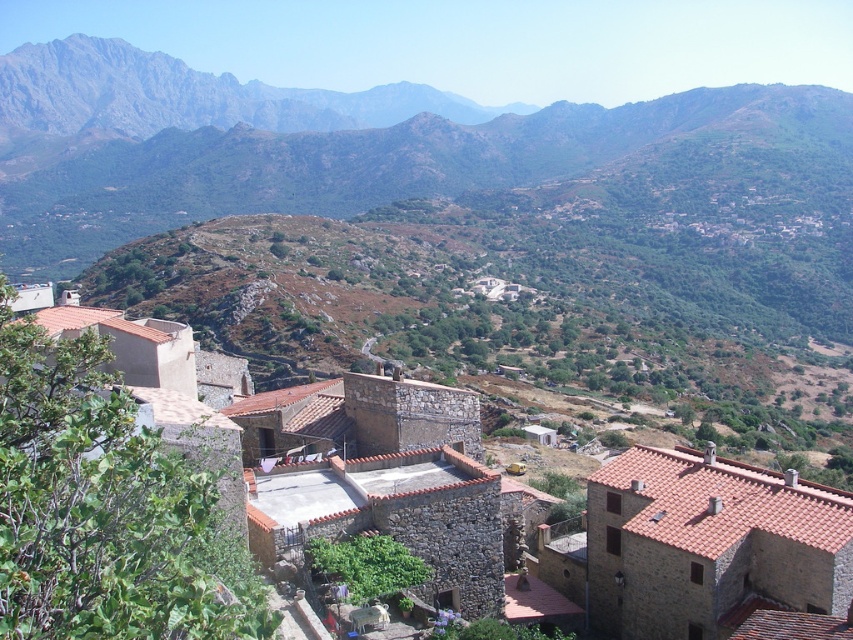
From the picture: Does green grassy hillside at center have a lesser width compared to brown stone village at center?

No, green grassy hillside at center is not thinner than brown stone village at center.

In order to click on green grassy hillside at center in this screenshot , I will do `click(444, 227)`.